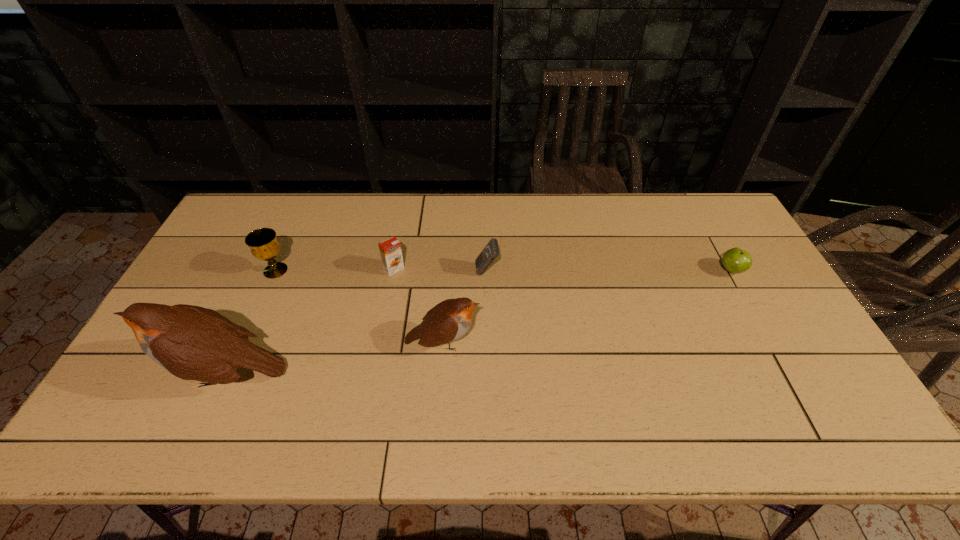
Locate an element on the screen. This screenshot has height=540, width=960. empty space between the left bird and the right bird is located at coordinates (335, 358).

Where is `vacant area between the shortest object and the third object from left to right`? vacant area between the shortest object and the third object from left to right is located at coordinates (563, 269).

Where is `free space between the chalice and the shortest object`? free space between the chalice and the shortest object is located at coordinates (503, 271).

Where is `vacant space that's between the calculator and the left bird`? The width and height of the screenshot is (960, 540). vacant space that's between the calculator and the left bird is located at coordinates (357, 322).

Find the location of a particular element. vacant point located between the left bird and the shortest object is located at coordinates (479, 322).

Where is `blank region between the right bird and the apple`? Image resolution: width=960 pixels, height=540 pixels. blank region between the right bird and the apple is located at coordinates (587, 306).

This screenshot has width=960, height=540. I want to click on vacant space that's between the left bird and the right bird, so click(x=335, y=358).

What are the coordinates of `free space between the shorter bird and the apple` in the screenshot? It's located at (587, 306).

What are the coordinates of `object that stands as the fifth closest to the calculator` in the screenshot? It's located at (735, 260).

Locate which object is the closest to the orange juice. Please provide its 2D coordinates. Your answer should be formatted as a tuple, i.e. [(x, y)], where the tuple contains the x and y coordinates of a point satisfying the conditions above.

[(449, 320)]